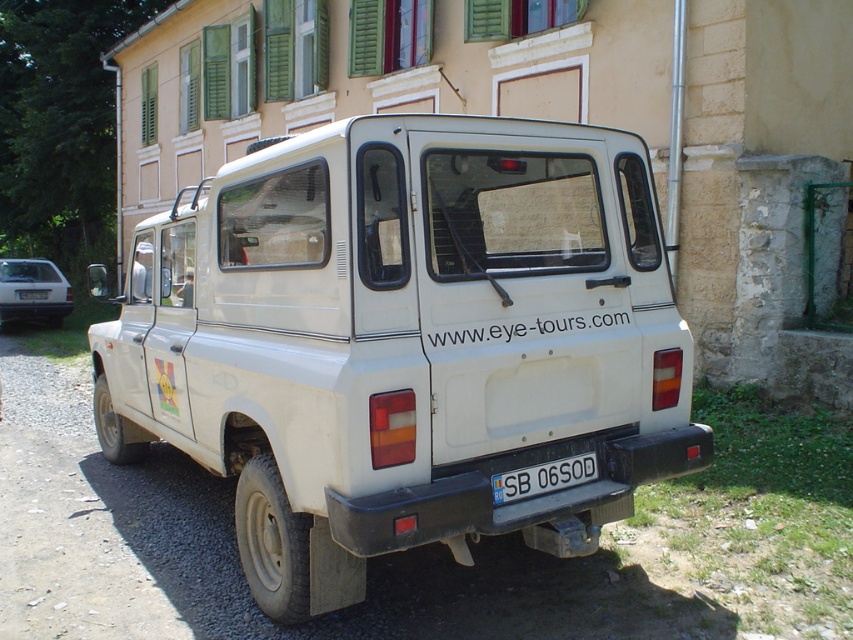
Question: Can you confirm if silver metallic sedan at left is wider than white plastic license plate at rear?

Choices:
 (A) yes
 (B) no

Answer: (A)

Question: Is silver metallic sedan at left above white plastic license plate at rear?

Choices:
 (A) yes
 (B) no

Answer: (A)

Question: Can you confirm if silver metallic sedan at left is smaller than white plastic license plate at rear?

Choices:
 (A) yes
 (B) no

Answer: (B)

Question: Which point appears closest to the camera in this image?

Choices:
 (A) (38, 296)
 (B) (584, 465)
 (C) (564, 369)
 (D) (13, 304)

Answer: (C)

Question: Which object is closer to the camera taking this photo?

Choices:
 (A) white plastic license plate at lower center
 (B) white matte pickup truck at center
 (C) white plastic license plate at rear

Answer: (A)

Question: Which object is the farthest from the white plastic license plate at lower center?

Choices:
 (A) silver metallic sedan at left
 (B) white matte pickup truck at center
 (C) white plastic license plate at rear

Answer: (A)